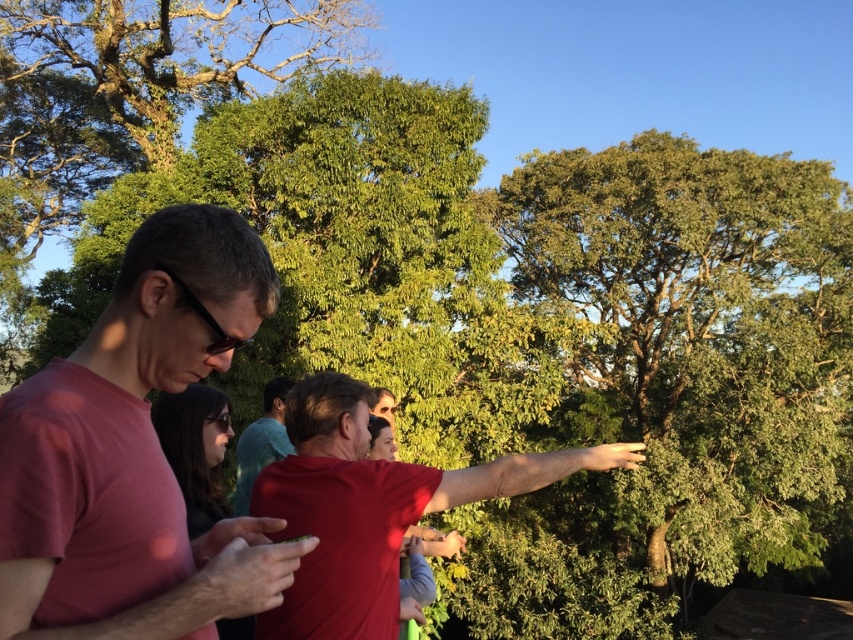
Question: Can you confirm if green leafy tree at upper right is smaller than matte red shirt at center?

Choices:
 (A) no
 (B) yes

Answer: (A)

Question: Which point is closer to the camera?

Choices:
 (A) (244, 476)
 (B) (395, 618)
 (C) (714, 150)
 (D) (167, 515)

Answer: (D)

Question: Which object is the farthest from the teal fabric shirt at center?

Choices:
 (A) red matte shirt at center
 (B) green leafy tree at upper right
 (C) matte red shirt at center

Answer: (B)

Question: In this image, where is matte red shirt at center located relative to red matte shirt at center?

Choices:
 (A) left
 (B) right

Answer: (A)

Question: Which object is farther from the camera taking this photo?

Choices:
 (A) green leafy tree at upper right
 (B) matte red shirt at center
 (C) teal fabric shirt at center
 (D) red matte shirt at center

Answer: (A)

Question: Is green leafy tree at upper right above matte red shirt at center?

Choices:
 (A) yes
 (B) no

Answer: (B)